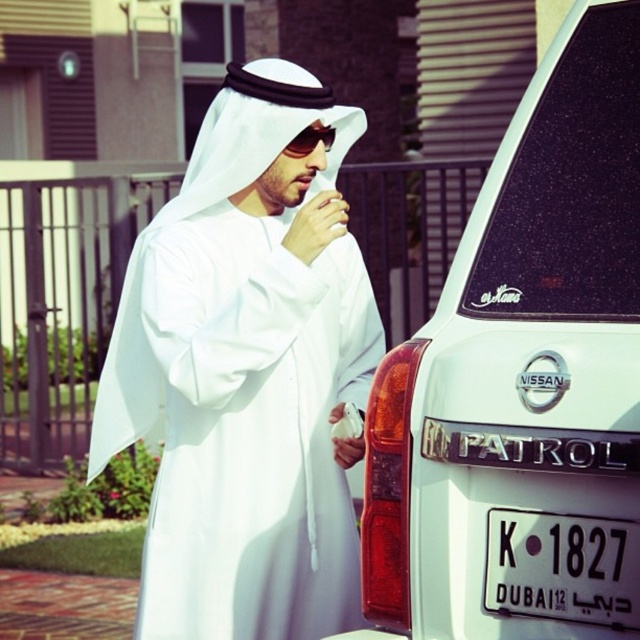
Question: Which point appears closest to the camera in this image?

Choices:
 (A) pos(492,532)
 (B) pos(504,525)
 (C) pos(284,152)
 (D) pos(292,342)

Answer: (B)

Question: Which point is farther from the camera taking this photo?

Choices:
 (A) (307, 129)
 (B) (612, 582)

Answer: (A)

Question: Considering the relative positions of black plastic license plate at lower right and shiny black sunglasses at center in the image provided, where is black plastic license plate at lower right located with respect to shiny black sunglasses at center?

Choices:
 (A) below
 (B) above

Answer: (A)

Question: Among these objects, which one is nearest to the camera?

Choices:
 (A) white matte nissan patrol at right
 (B) white matte/soft fabric at center
 (C) shiny black sunglasses at center

Answer: (A)

Question: Does black plastic license plate at lower right appear over shiny black sunglasses at center?

Choices:
 (A) yes
 (B) no

Answer: (B)

Question: Considering the relative positions of white matte nissan patrol at right and shiny black sunglasses at center in the image provided, where is white matte nissan patrol at right located with respect to shiny black sunglasses at center?

Choices:
 (A) right
 (B) left

Answer: (A)